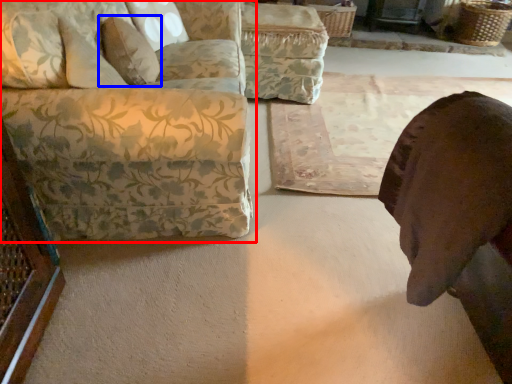
Question: Which of the following is the closest to the observer, studio couch (highlighted by a red box) or pillow (highlighted by a blue box)?

Choices:
 (A) studio couch
 (B) pillow

Answer: (A)